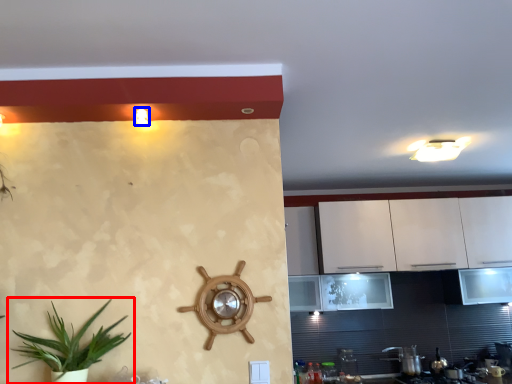
Question: Among these objects, which one is farthest to the camera, houseplant (highlighted by a red box) or light fixture (highlighted by a blue box)?

Choices:
 (A) houseplant
 (B) light fixture

Answer: (B)